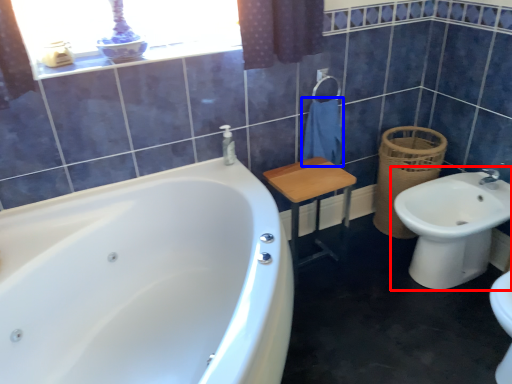
Question: Which object appears closest to the camera in this image, sink (highlighted by a red box) or bath towel (highlighted by a blue box)?

Choices:
 (A) sink
 (B) bath towel

Answer: (A)